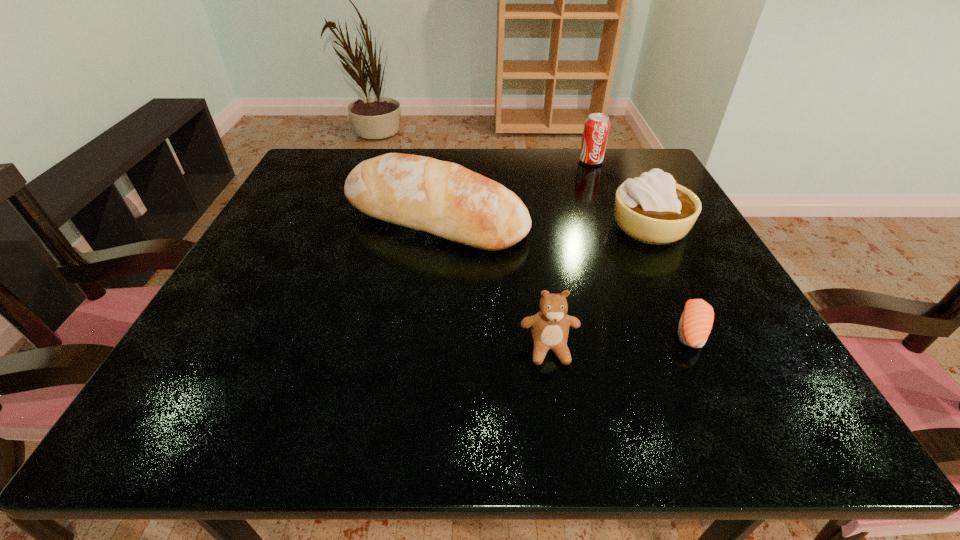
I want to click on bread, so click(x=445, y=199).

Where is `whipped cream`? The width and height of the screenshot is (960, 540). whipped cream is located at coordinates (654, 209).

The height and width of the screenshot is (540, 960). Find the location of `the farthest object`. the farthest object is located at coordinates (596, 129).

I want to click on teddy bear, so click(x=550, y=326).

This screenshot has height=540, width=960. I want to click on sushi, so click(696, 322).

In order to click on vacant position located 0.180m on the front of the bread in this screenshot , I will do `click(420, 327)`.

Find the location of `vacant space situated on the front of the whipped cream`. vacant space situated on the front of the whipped cream is located at coordinates (686, 302).

Locate an element on the screen. vacant space located 0.120m on the logo side of the farthest object is located at coordinates (603, 192).

At what (x,y) coordinates should I click in order to perform the action: click on vacant area located on the front-facing side of the teddy bear. Please return your answer as a coordinate pair (x, y). The width and height of the screenshot is (960, 540). Looking at the image, I should click on (558, 410).

I want to click on free spot located on the back of the sushi, so 638,219.